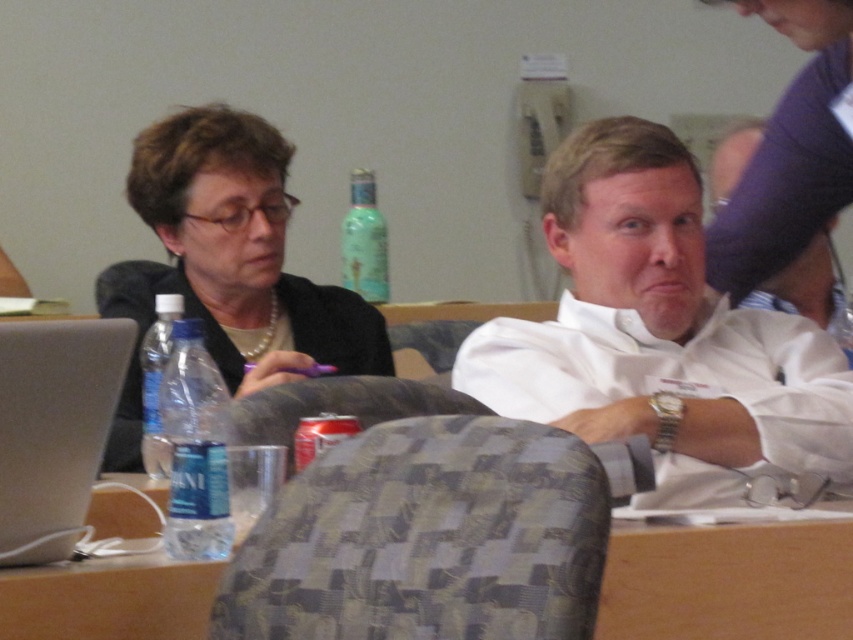
Which is above, white shirt at center or wooden table at center?

white shirt at center is above.

Looking at this image, who is shorter, white shirt at center or wooden table at center?

With less height is wooden table at center.

You are a GUI agent. You are given a task and a screenshot of the screen. Output one action in this format:
    pyautogui.click(x=<x>, y=<y>)
    Task: Click on the white shirt at center
    This screenshot has width=853, height=640.
    Given the screenshot: What is the action you would take?
    pyautogui.click(x=660, y=336)

Is wooden table at center below silver metallic laptop at left?

Indeed, wooden table at center is positioned under silver metallic laptop at left.

Based on the photo, how much distance is there between wooden table at center and silver metallic laptop at left?

wooden table at center is 24.15 inches away from silver metallic laptop at left.

Locate an element on the screen. wooden table at center is located at coordinates (728, 582).

Is textured fabric chair at center thinner than wooden table at center?

No, textured fabric chair at center is not thinner than wooden table at center.

Who is more distant from viewer, (x=451, y=467) or (x=627, y=604)?

Positioned behind is point (x=627, y=604).

Is point (273, 605) closer to camera compared to point (717, 544)?

Yes, it is.

The width and height of the screenshot is (853, 640). I want to click on textured fabric chair at center, so click(x=427, y=538).